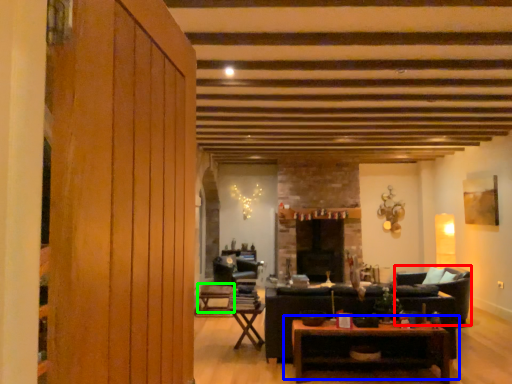
Question: Considering the real-world distances, which object is farthest from armchair (highlighted by a red box)? table (highlighted by a blue box) or table (highlighted by a green box)?

Choices:
 (A) table
 (B) table

Answer: (B)